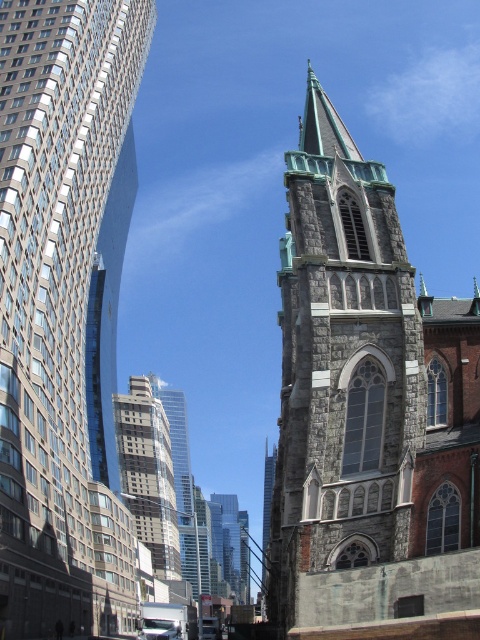
Locate an element on the screen. gray stone church steeple at center is located at coordinates (369, 413).

Find the location of `gray stone church steeple at center`. gray stone church steeple at center is located at coordinates (369, 413).